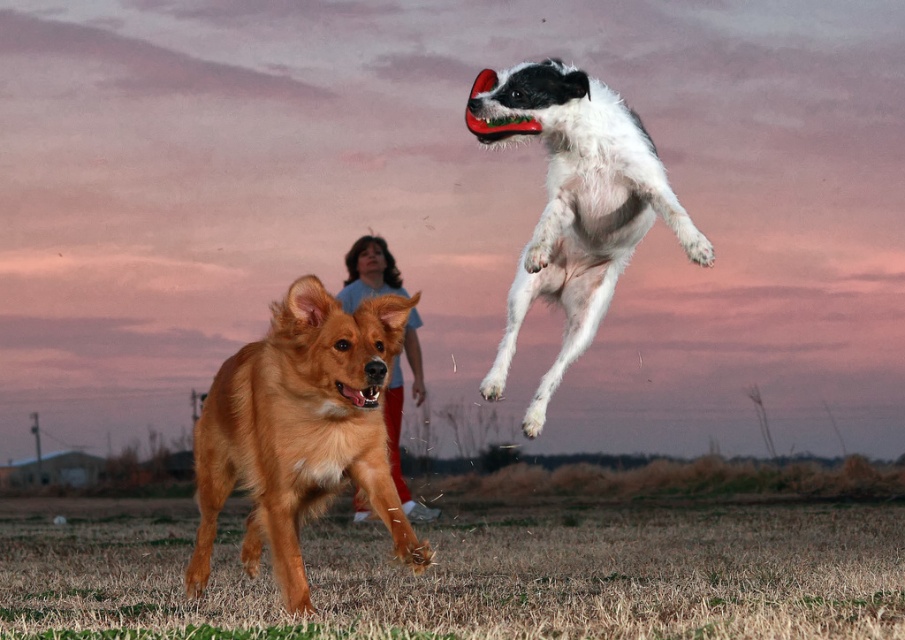
Question: Which point is farther from the camera taking this photo?

Choices:
 (A) (560, 355)
 (B) (491, 125)
 (C) (275, 428)
 (D) (386, 417)

Answer: (D)

Question: From the image, what is the correct spatial relationship of white fur dog at upper right in relation to rubber red frisbee at upper center?

Choices:
 (A) right
 (B) left

Answer: (A)

Question: Can you confirm if white fur dog at upper right is bigger than rubber red frisbee at upper center?

Choices:
 (A) no
 (B) yes

Answer: (B)

Question: Which of these objects is positioned closest to the golden fur dog at center?

Choices:
 (A) white fur dog at upper right
 (B) rubber red frisbee at upper center

Answer: (A)

Question: Is golden fur dog at center closer to the viewer compared to light blue t-shirt at center?

Choices:
 (A) yes
 (B) no

Answer: (A)

Question: Based on their relative distances, which object is farther from the light blue t-shirt at center?

Choices:
 (A) rubber red frisbee at upper center
 (B) white fur dog at upper right
 (C) golden fur dog at center

Answer: (C)